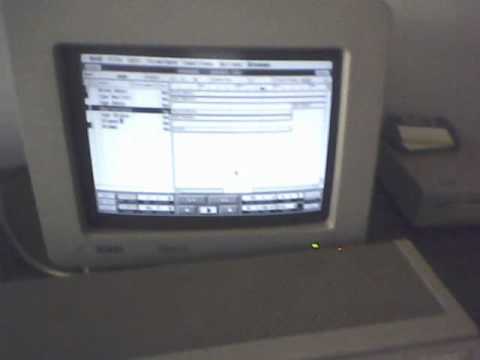
In order to click on center of monitor in this screenshot , I will do `click(207, 144)`.